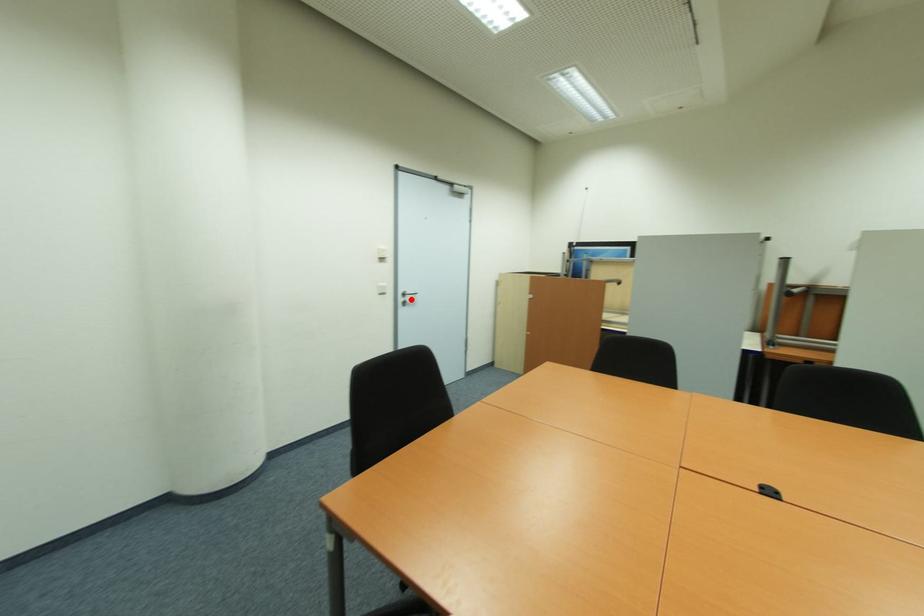
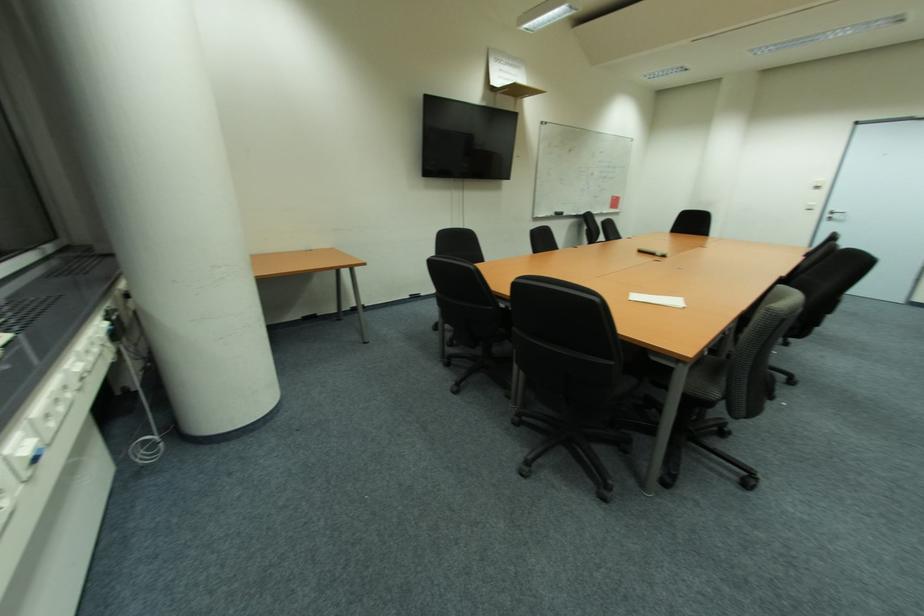
In the second image, find the point that corresponds to the highlighted location in the first image.

(842, 217)